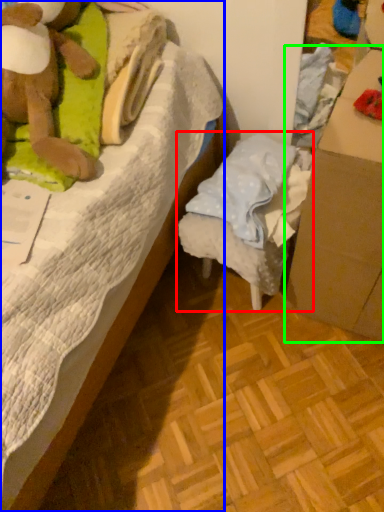
Question: Estimate the real-world distances between objects in this image. Which object is closer to furniture (highlighted by a red box), bed (highlighted by a blue box) or cardboard box (highlighted by a green box)?

Choices:
 (A) bed
 (B) cardboard box

Answer: (B)